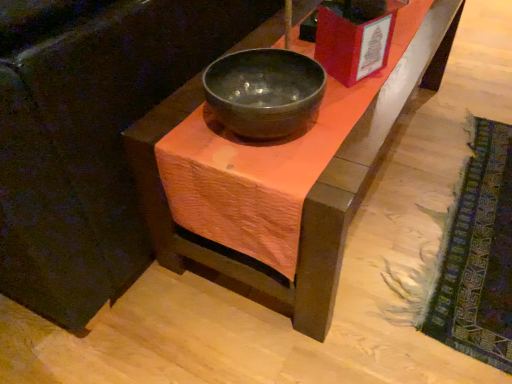
Find the location of `free region under textured woolen mat at lower right (from a real-world perspective)`. free region under textured woolen mat at lower right (from a real-world perspective) is located at coordinates (457, 219).